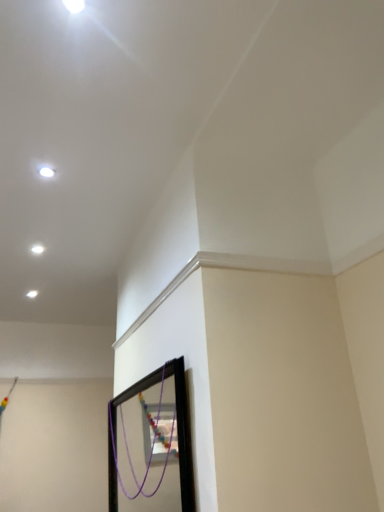
Where is `white glossy light at upper left, the second light positioned from the right`? white glossy light at upper left, the second light positioned from the right is located at coordinates (37, 249).

What do you see at coordinates (37, 249) in the screenshot? I see `white glossy light at upper left, the 1th light ordered from the bottom` at bounding box center [37, 249].

Describe the element at coordinates (47, 172) in the screenshot. I see `white glossy light at upper left, the second light when ordered from bottom to top` at that location.

The height and width of the screenshot is (512, 384). In order to click on white glossy light at upper left, the second light positioned from the left in this screenshot , I will do `click(47, 172)`.

Based on the photo, measure the distance between white glossy light at upper left, the second light in the back-to-front sequence, and camera.

white glossy light at upper left, the second light in the back-to-front sequence, is 6.53 feet away from camera.

Find the location of a particular element. The image size is (384, 512). white glossy light at upper left, the second light positioned from the right is located at coordinates (37, 249).

Between white glossy light at upper left, arranged as the first light when viewed from the left, and white glossy light at upper left, the second light positioned from the left, which one appears on the right side from the viewer's perspective?

From the viewer's perspective, white glossy light at upper left, the second light positioned from the left, appears more on the right side.

Which is behind, white glossy light at upper left, the second light in the top-to-bottom sequence, or white glossy light at upper left, the second light positioned from the left?

white glossy light at upper left, the second light in the top-to-bottom sequence.

Considering the points (43, 249) and (40, 170), which point is in front, point (43, 249) or point (40, 170)?

The point (40, 170) is closer to the camera.

From the image's perspective, would you say white glossy light at upper left, which is counted as the first light, starting from the back, is positioned over white glossy light at upper left, the first light viewed from the right?

No, from the image's perspective, white glossy light at upper left, which is counted as the first light, starting from the back, is not above white glossy light at upper left, the first light viewed from the right.

Based on the photo, from a real-world perspective, is white glossy light at upper left, the 1th light ordered from the bottom, located higher than white glossy light at upper left, the second light when ordered from bottom to top?

No, from a real-world perspective, white glossy light at upper left, the 1th light ordered from the bottom, is not on top of white glossy light at upper left, the second light when ordered from bottom to top.

Considering the relative sizes of white glossy light at upper left, which is counted as the first light, starting from the back, and white glossy light at upper left, the 1th light viewed from the front, in the image provided, is white glossy light at upper left, which is counted as the first light, starting from the back, wider than white glossy light at upper left, the 1th light viewed from the front,?

Incorrect, the width of white glossy light at upper left, which is counted as the first light, starting from the back, does not surpass that of white glossy light at upper left, the 1th light viewed from the front.

Considering the sizes of objects white glossy light at upper left, arranged as the first light when viewed from the left, and white glossy light at upper left, the 1th light viewed from the top, in the image provided, who is shorter, white glossy light at upper left, arranged as the first light when viewed from the left, or white glossy light at upper left, the 1th light viewed from the top,?

With less height is white glossy light at upper left, the 1th light viewed from the top.

In the scene shown: Between white glossy light at upper left, the second light positioned from the right, and white glossy light at upper left, the 1th light viewed from the front, which one has smaller size?

Smaller between the two is white glossy light at upper left, the 1th light viewed from the front.

Would you say white glossy light at upper left, the first light viewed from the right, is part of white glossy light at upper left, the second light positioned from the right,'s contents?

No, white glossy light at upper left, the second light positioned from the right, does not contain white glossy light at upper left, the first light viewed from the right.

Is white glossy light at upper left, the second light positioned from the right, positioned far away from white glossy light at upper left, the second light in the back-to-front sequence?

No, white glossy light at upper left, the second light positioned from the right, is not far from white glossy light at upper left, the second light in the back-to-front sequence.

Is white glossy light at upper left, the second light positioned from the front, positioned with its back to white glossy light at upper left, the second light when ordered from bottom to top?

white glossy light at upper left, the second light positioned from the front, is not turned away from white glossy light at upper left, the second light when ordered from bottom to top.

How many degrees apart are the facing directions of white glossy light at upper left, the second light positioned from the right, and white glossy light at upper left, the second light in the back-to-front sequence?

white glossy light at upper left, the second light positioned from the right, and white glossy light at upper left, the second light in the back-to-front sequence, are facing 0.00437 degrees away from each other.

Locate an element on the screen. This screenshot has height=512, width=384. light beneath the white glossy light at upper left, the first light viewed from the right (from a real-world perspective) is located at coordinates [37, 249].

Is white glossy light at upper left, the first light viewed from the right, to the left or to the right of white glossy light at upper left, the second light positioned from the right, in the image?

From the image, it's evident that white glossy light at upper left, the first light viewed from the right, is to the right of white glossy light at upper left, the second light positioned from the right.

Relative to white glossy light at upper left, arranged as the first light when viewed from the left, is white glossy light at upper left, the 1th light viewed from the top, in front or behind?

white glossy light at upper left, the 1th light viewed from the top, is in front of white glossy light at upper left, arranged as the first light when viewed from the left.

Which point is more distant from viewer, (39,170) or (39,252)?

The point (39,252) is behind.

From the image's perspective, which object appears higher, white glossy light at upper left, the second light in the back-to-front sequence, or white glossy light at upper left, the second light in the top-to-bottom sequence?

white glossy light at upper left, the second light in the back-to-front sequence.

From a real-world perspective, which is physically above, white glossy light at upper left, the 1th light viewed from the front, or white glossy light at upper left, arranged as the first light when viewed from the left?

white glossy light at upper left, the 1th light viewed from the front, from a real-world perspective.

Does white glossy light at upper left, the 1th light viewed from the front, have a greater width compared to white glossy light at upper left, the second light positioned from the front?

Correct, the width of white glossy light at upper left, the 1th light viewed from the front, exceeds that of white glossy light at upper left, the second light positioned from the front.

Is white glossy light at upper left, the 1th light viewed from the top, taller than white glossy light at upper left, arranged as the first light when viewed from the left?

Incorrect, the height of white glossy light at upper left, the 1th light viewed from the top, is not larger of that of white glossy light at upper left, arranged as the first light when viewed from the left.

Between white glossy light at upper left, the 1th light viewed from the top, and white glossy light at upper left, the second light positioned from the right, which one has larger size?

Bigger between the two is white glossy light at upper left, the second light positioned from the right.

Looking at this image, would you say white glossy light at upper left, the second light when ordered from bottom to top, is inside or outside white glossy light at upper left, the 1th light ordered from the bottom?

white glossy light at upper left, the second light when ordered from bottom to top, is not inside white glossy light at upper left, the 1th light ordered from the bottom, it's outside.

Is white glossy light at upper left, the second light positioned from the left, next to white glossy light at upper left, arranged as the first light when viewed from the left?

There is a gap between white glossy light at upper left, the second light positioned from the left, and white glossy light at upper left, arranged as the first light when viewed from the left.

Is white glossy light at upper left, the 1th light viewed from the front, oriented away from white glossy light at upper left, the second light in the top-to-bottom sequence?

No.

In order to click on light in front of the white glossy light at upper left, arranged as the first light when viewed from the left in this screenshot , I will do `click(47, 172)`.

Where is `light lying in front of the white glossy light at upper left, the second light in the top-to-bottom sequence`? light lying in front of the white glossy light at upper left, the second light in the top-to-bottom sequence is located at coordinates (47, 172).

You are a GUI agent. You are given a task and a screenshot of the screen. Output one action in this format:
    pyautogui.click(x=<x>, y=<y>)
    Task: Click on the light on the right of white glossy light at upper left, which is counted as the first light, starting from the back
    
    Given the screenshot: What is the action you would take?
    pyautogui.click(x=47, y=172)